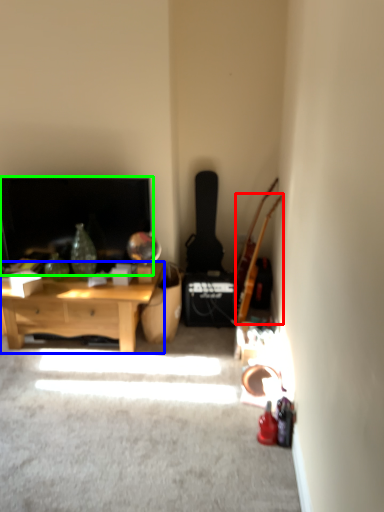
Question: Which is farther away from guitar (highlighted by a red box)? desk (highlighted by a blue box) or fireplace (highlighted by a green box)?

Choices:
 (A) desk
 (B) fireplace

Answer: (B)